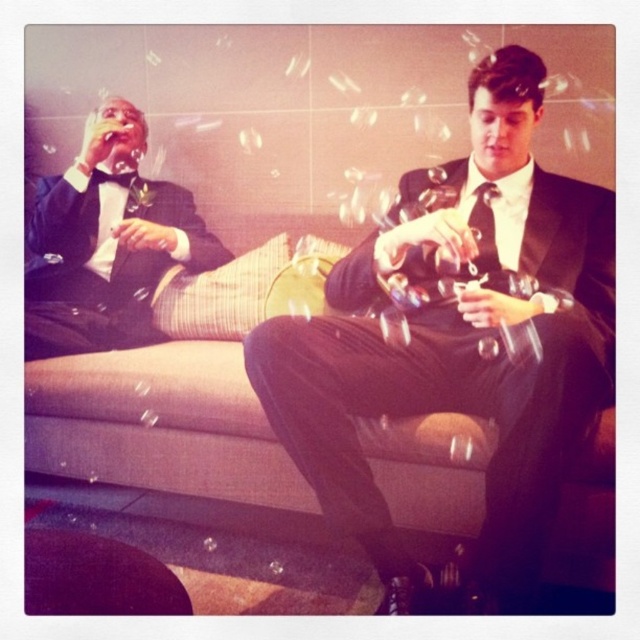
You are standing in the room and see the point marked at coordinates point (138,432). If you want to reach it without moving your feet, can you do so with your outstretched hand?

The point (138,432) is 5.12 feet away from the viewer. Since the average human arm length is about 2.5 feet, you cannot reach it without moving your feet.